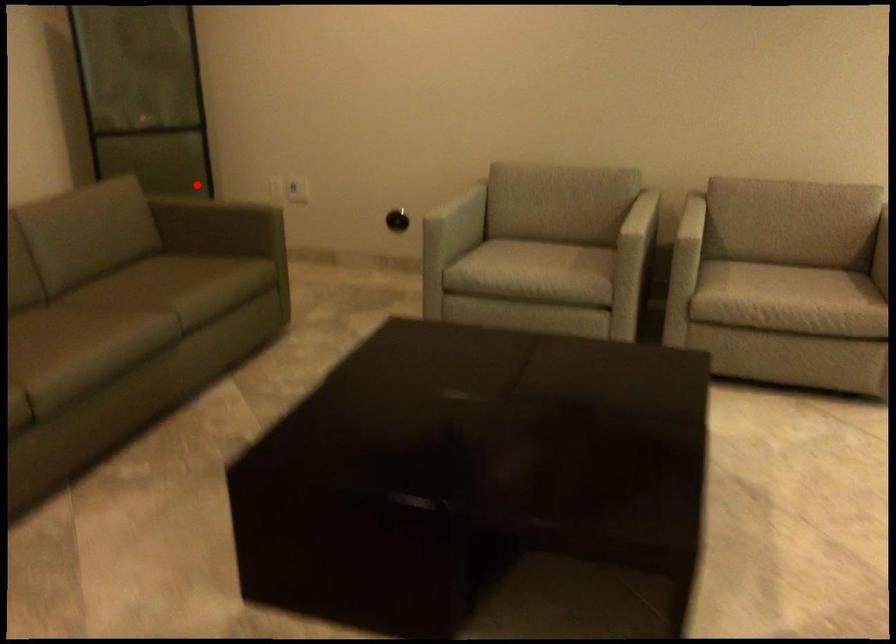
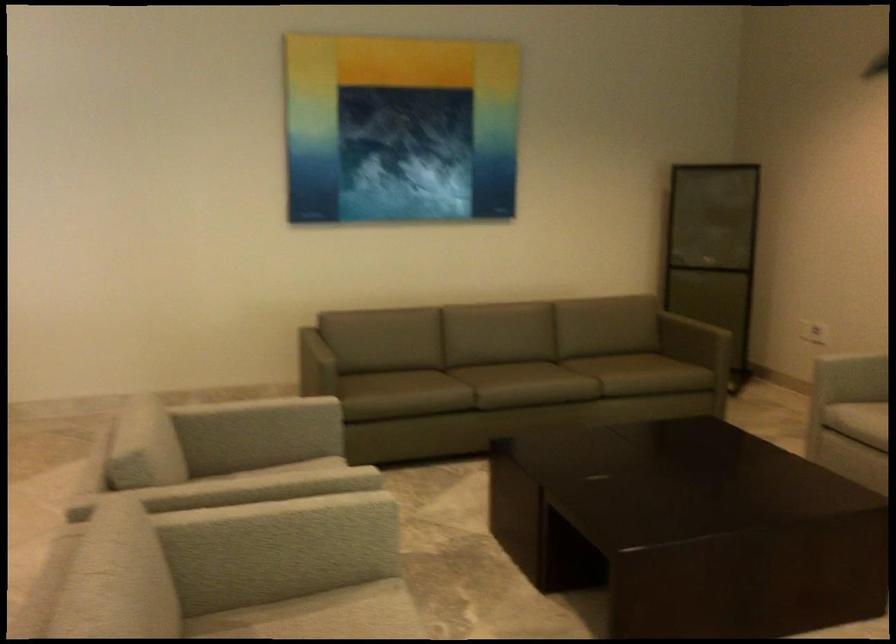
Where in the second image is the point corresponding to the highlighted location from the first image?

(713, 317)